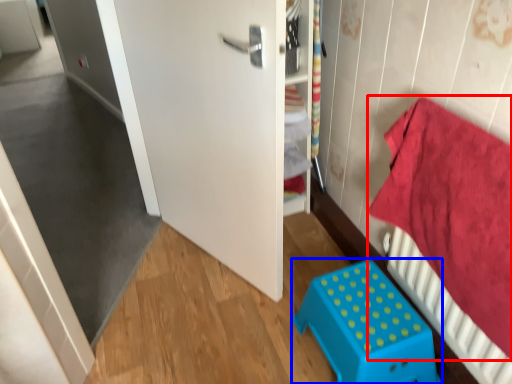
Question: Which object appears farthest to the camera in this image, bedding (highlighted by a red box) or furniture (highlighted by a blue box)?

Choices:
 (A) bedding
 (B) furniture

Answer: (B)